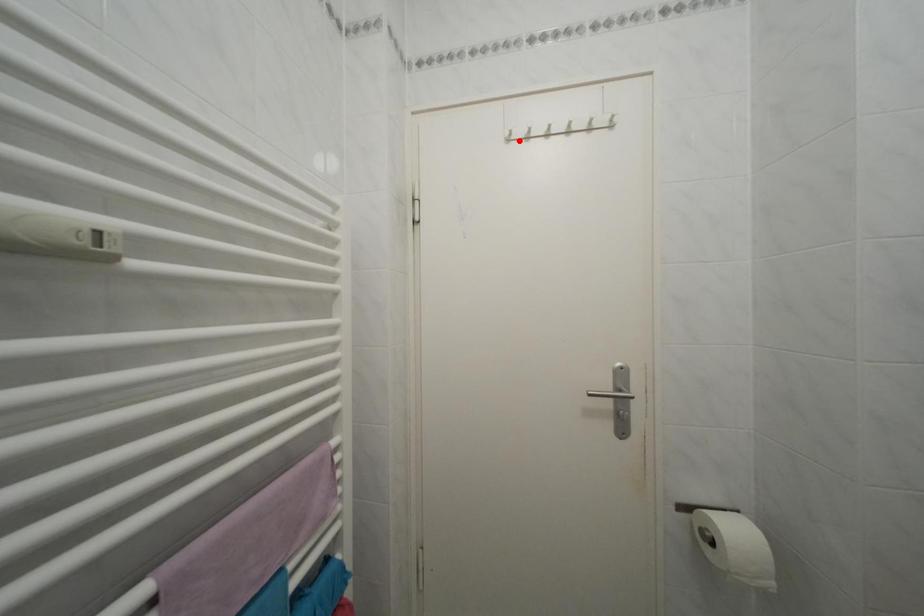
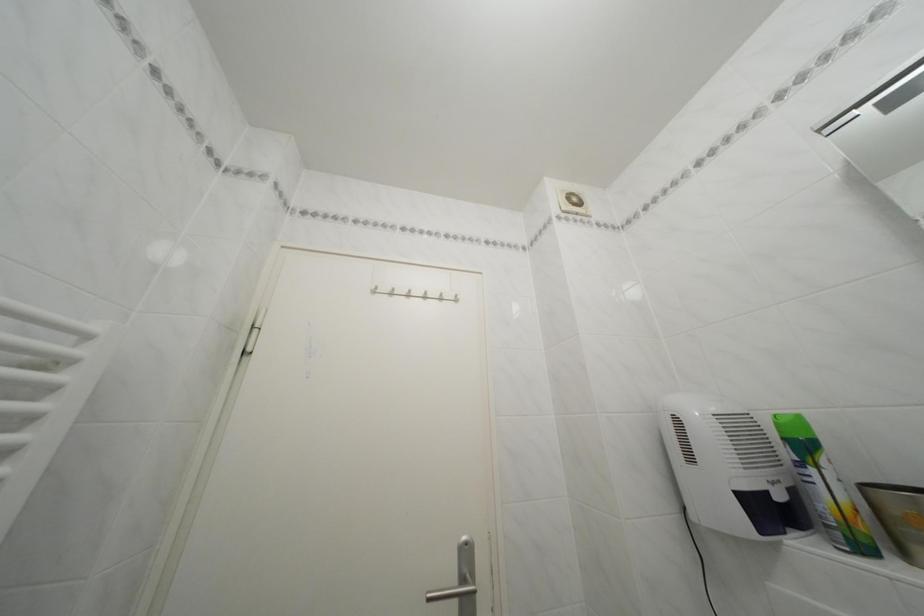
The point at the highlighted location is marked in the first image. Where is the corresponding point in the second image?

(385, 294)